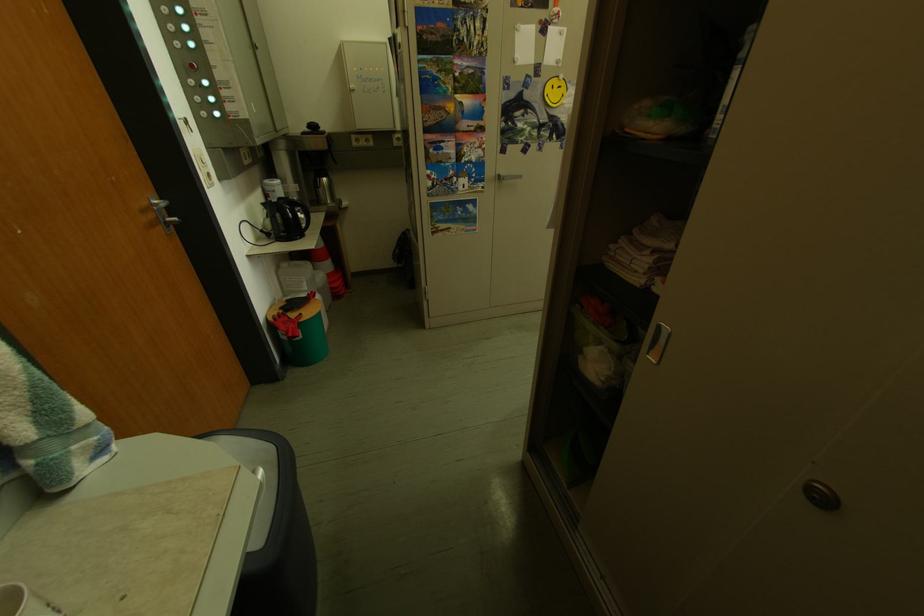
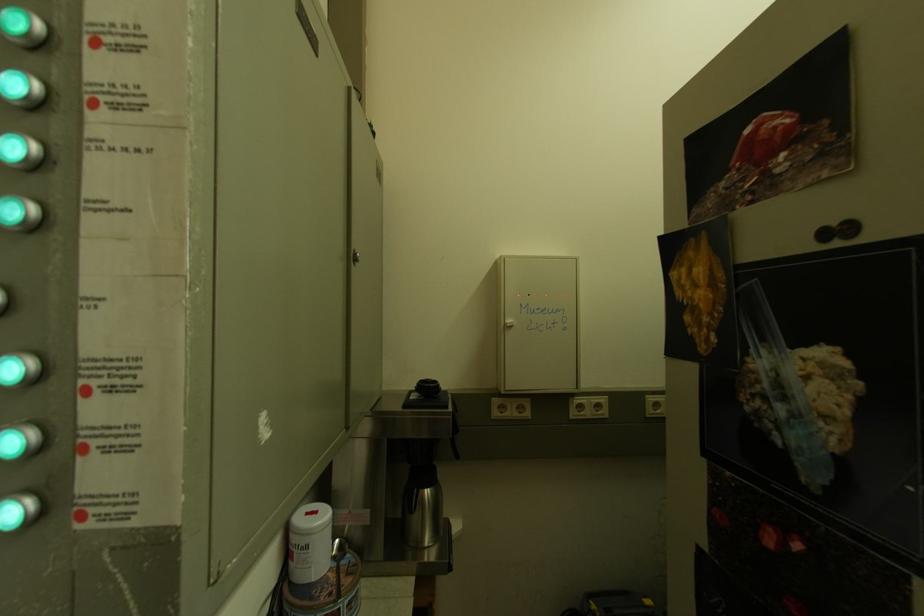
Where in the second image is the point corresponding to the point at 286,193 from the first image?

(320, 551)